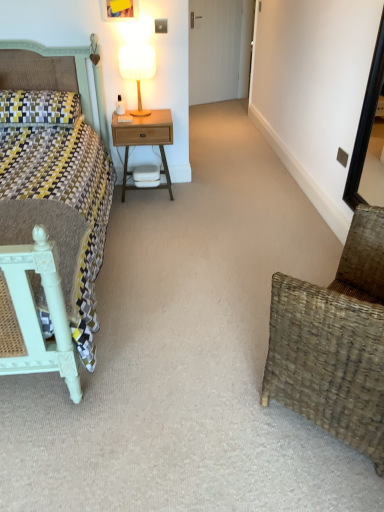
Question: From a real-world perspective, relative to wooden table lamp at upper center, is matte green bed at left vertically above or below?

Choices:
 (A) below
 (B) above

Answer: (A)

Question: Is point (56, 315) closer or farther from the camera than point (153, 65)?

Choices:
 (A) farther
 (B) closer

Answer: (B)

Question: Estimate the real-world distances between objects in this image. Which object is closer to the matte green bed at left?

Choices:
 (A) woodenmaterial/texturenightstand at center
 (B) wooden table lamp at upper center
 (C) white glossy door at upper center
 (D) woven brown chair at lower right
 (E) black wooden mirror at right

Answer: (A)

Question: Which is farther from the yellow and gray woven pillow at left?

Choices:
 (A) wooden table lamp at upper center
 (B) white glossy door at upper center
 (C) woven brown chair at lower right
 (D) matte green bed at left
 (E) woodenmaterial/texturenightstand at center

Answer: (B)